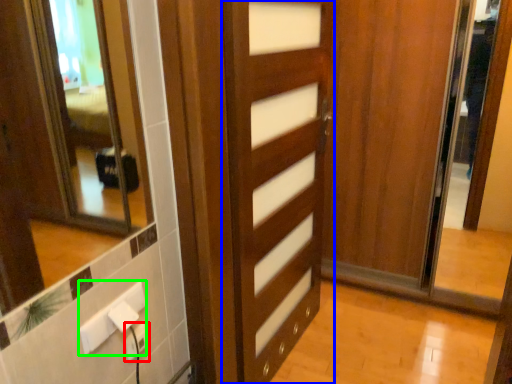
Question: Based on their relative distances, which object is farther from electric outlet (highlighted by a red box)? Choose from door (highlighted by a blue box) and electric outlet (highlighted by a green box).

Choices:
 (A) door
 (B) electric outlet

Answer: (A)